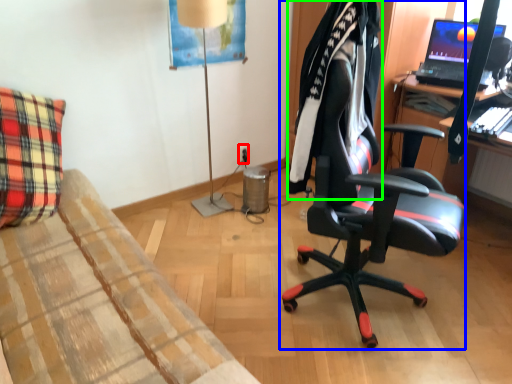
Question: Which is nearer to the power outlet (highlighted by a red box)? chair (highlighted by a blue box) or clothing (highlighted by a green box).

Choices:
 (A) chair
 (B) clothing

Answer: (A)